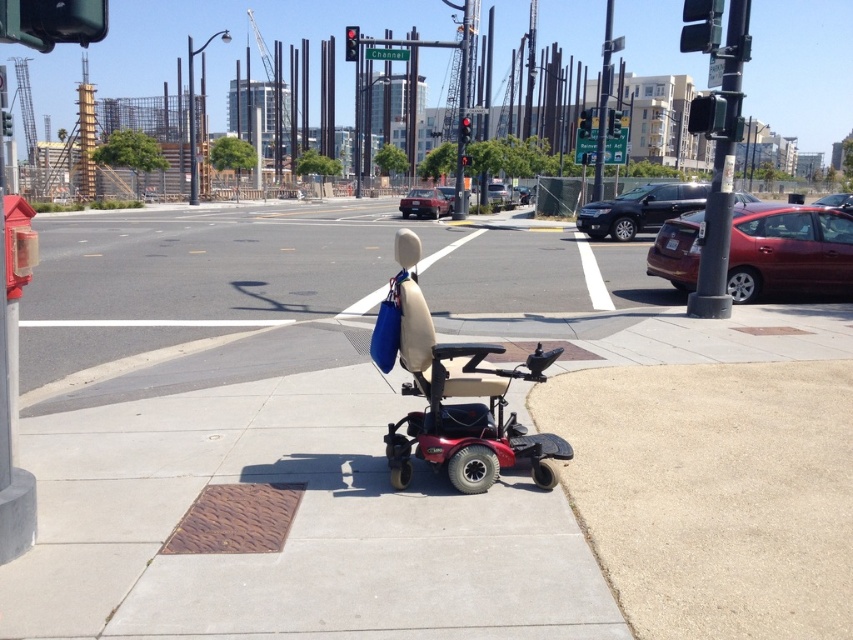
The image size is (853, 640). Describe the element at coordinates (639, 209) in the screenshot. I see `shiny black sedan at center` at that location.

Does shiny black sedan at center have a smaller size compared to red plastic traffic light at center?

Indeed, shiny black sedan at center has a smaller size compared to red plastic traffic light at center.

Is point (604, 227) farther from viewer compared to point (465, 160)?

No, (604, 227) is in front of (465, 160).

Image resolution: width=853 pixels, height=640 pixels. Identify the location of shiny black sedan at center. (639, 209).

Does point (804, 211) come closer to viewer compared to point (463, 128)?

Yes, it is.

Which is in front, point (821, 282) or point (457, 129)?

Point (821, 282) is in front.

Where is `shiny metallic sedan at right`? This screenshot has width=853, height=640. shiny metallic sedan at right is located at coordinates (788, 250).

Between gray concrete sidewalk at center and metallic traffic light at upper center, which one appears on the right side from the viewer's perspective?

From the viewer's perspective, metallic traffic light at upper center appears more on the right side.

Is gray concrete sidewalk at center shorter than metallic traffic light at upper center?

Correct, gray concrete sidewalk at center is not as tall as metallic traffic light at upper center.

Find the location of a particular element. The height and width of the screenshot is (640, 853). gray concrete sidewalk at center is located at coordinates tap(294, 513).

The width and height of the screenshot is (853, 640). I want to click on gray concrete sidewalk at center, so click(x=294, y=513).